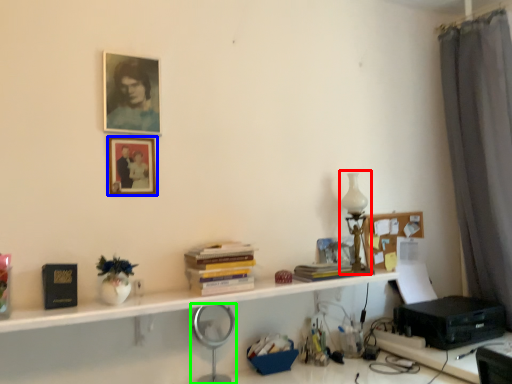
Question: Estimate the real-world distances between objects in this image. Which object is closer to table lamp (highlighted by a red box), picture frame (highlighted by a blue box) or magnifying glass (highlighted by a green box)?

Choices:
 (A) picture frame
 (B) magnifying glass

Answer: (B)